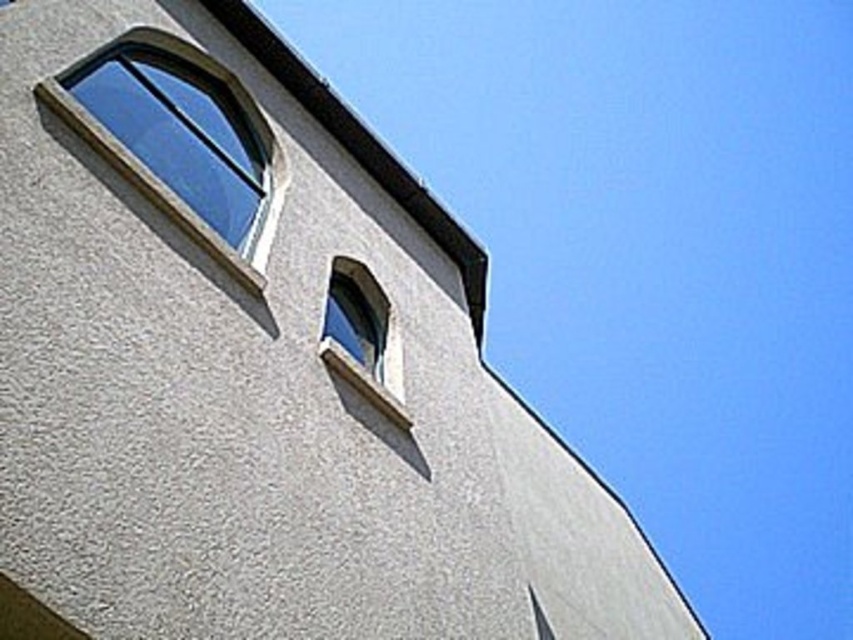
You are a window installer checking the positioning of the clear glass window at upper left and the clear glass window at upper center. Which window is closer to you?

The clear glass window at upper left is closer to you because it is in front of the clear glass window at upper center.

You are an architect designing a new building and want to replicate the window sizes seen in the image. You have two clear glass windows labeled as clear glass window at upper left and clear glass window at upper center. Which window should you make larger to match the original design?

The clear glass window at upper left should be made larger than the clear glass window at upper center to match the original design, as the clear glass window at upper left has a larger size compared to clear glass window at upper center.